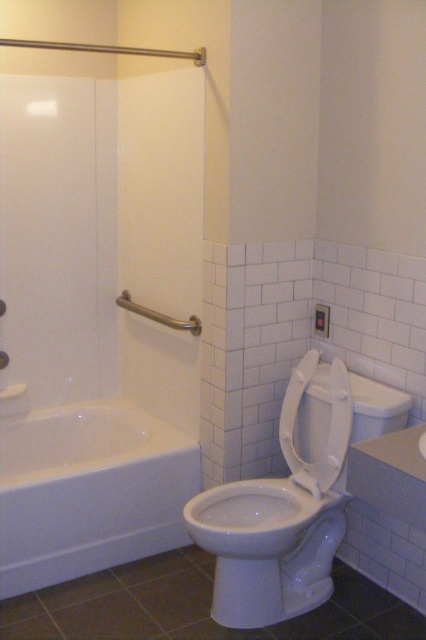
You are a contractor measuring the bathroom layout. You need to install a new grab bar between the white glossy bathtub at lower left and the white glossy screen door at left. Based on their positions, which object should the grab bar be closer to?

The grab bar should be closer to the white glossy screen door at left because the white glossy bathtub at lower left is to the right of the white glossy screen door at left, meaning the screen door is on the left side and the bathtub is positioned to its right.

You are a plumber trying to replace a broken pipe under the bathroom floor. You need to access the area behind the white glossy bathtub at lower left and the white glossy screen door at left. Which object should you move first to gain access?

The white glossy screen door at left should be moved first because it is narrower than the white glossy bathtub at lower left, making it easier to maneuver out of the way.